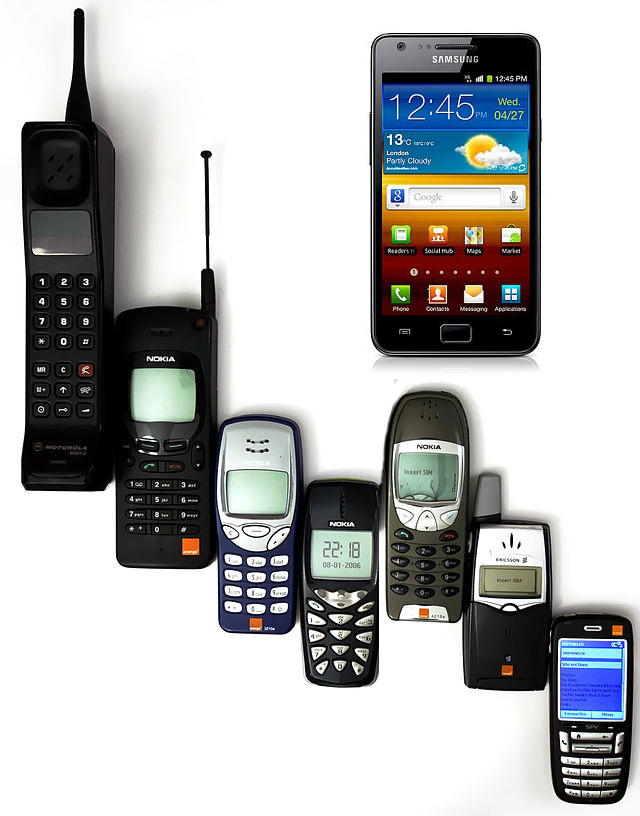
Identify the location of number keypad. (61, 312), (159, 494), (258, 581), (338, 639), (418, 555), (588, 768).